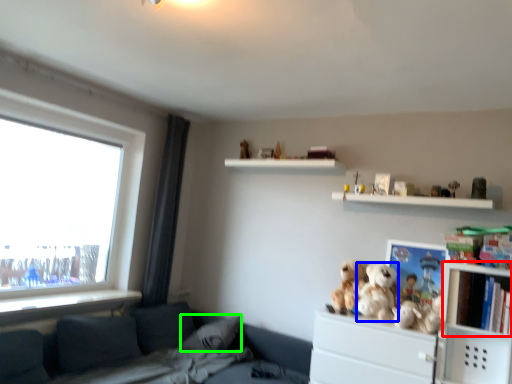
Question: Which object is positioned closest to cabinet (highlighted by a red box)? Select from toy (highlighted by a blue box) and pillow (highlighted by a green box).

Choices:
 (A) toy
 (B) pillow

Answer: (A)